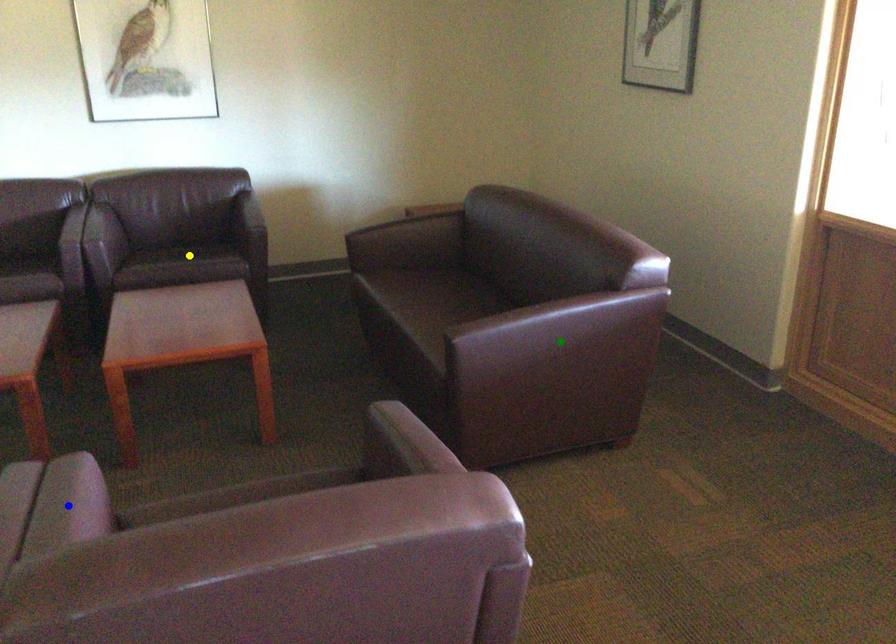
Order these from farthest to nearest:
green point
yellow point
blue point

yellow point < green point < blue point